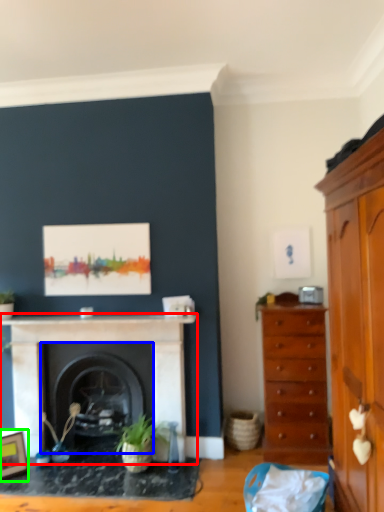
Question: Estimate the real-world distances between objects in this image. Which object is farther from fireplace (highlighted by a red box), fireplace (highlighted by a blue box) or picture frame (highlighted by a green box)?

Choices:
 (A) fireplace
 (B) picture frame

Answer: (B)